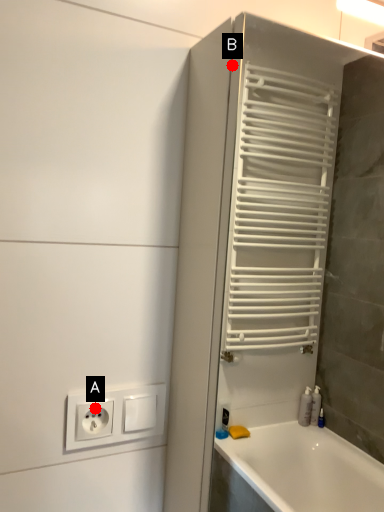
Question: Two points are circled on the image, labeled by A and B beside each circle. Which of the following is the farthest from the observer?

Choices:
 (A) A is further
 (B) B is further

Answer: (A)